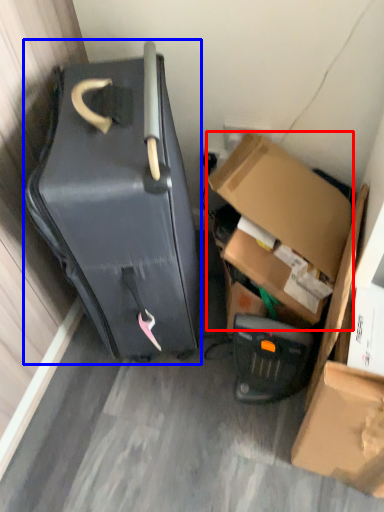
Question: Which object appears farthest to the camera in this image, box (highlighted by a red box) or suitcase (highlighted by a blue box)?

Choices:
 (A) box
 (B) suitcase

Answer: (A)